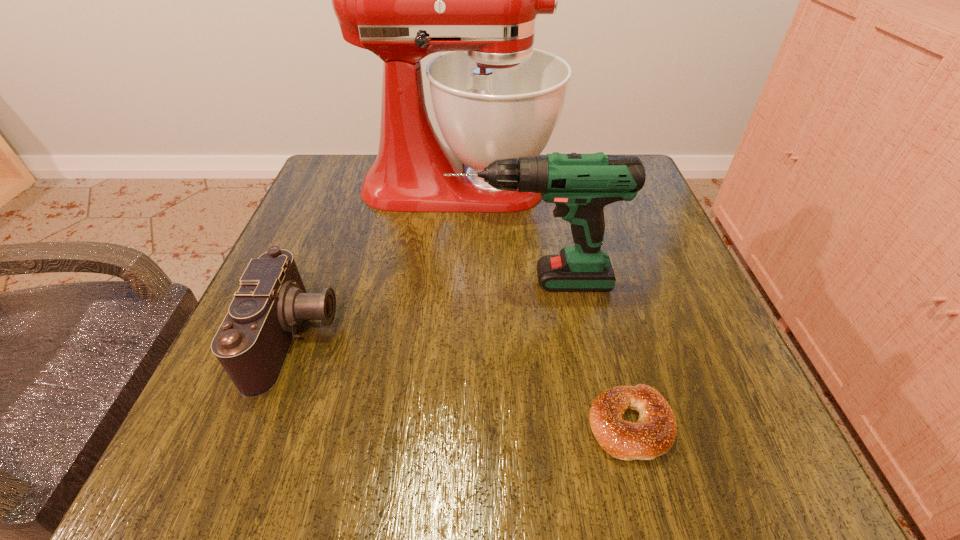
Locate an element on the screen. This screenshot has width=960, height=540. blank space located 0.090m on the back of the bagel is located at coordinates (608, 340).

Find the location of a particular element. The width and height of the screenshot is (960, 540). object present at the far edge is located at coordinates (494, 96).

The width and height of the screenshot is (960, 540). Find the location of `object located in the near edge section of the desktop`. object located in the near edge section of the desktop is located at coordinates (653, 435).

The width and height of the screenshot is (960, 540). I want to click on mixer that is at the left edge, so click(x=494, y=96).

The height and width of the screenshot is (540, 960). I want to click on camera located in the left edge section of the desktop, so click(252, 343).

At what (x,y) coordinates should I click in order to perform the action: click on drill that is at the right edge. Please return your answer as a coordinate pair (x, y). Looking at the image, I should click on (581, 185).

The image size is (960, 540). Find the location of `bagel situated at the right edge`. bagel situated at the right edge is located at coordinates (653, 435).

Locate an element on the screen. Image resolution: width=960 pixels, height=540 pixels. object present at the far left corner is located at coordinates (494, 96).

Identify the location of object that is at the near right corner. (653, 435).

Identify the location of vacant space at the far edge. Image resolution: width=960 pixels, height=540 pixels. (539, 206).